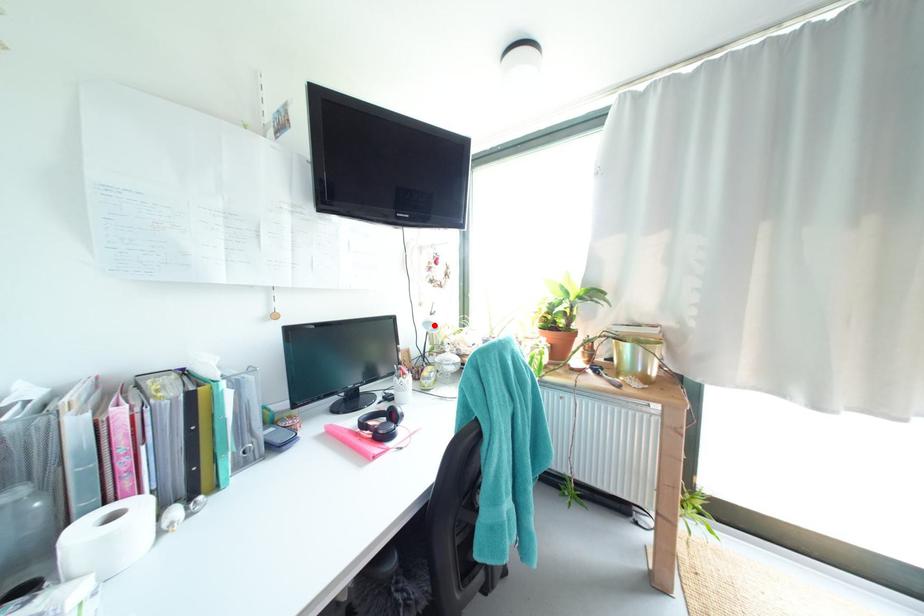
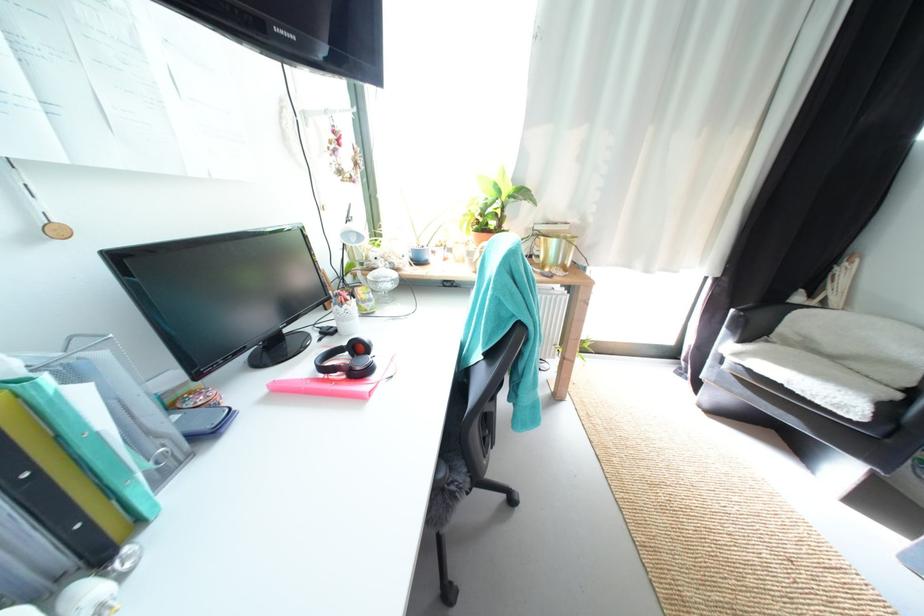
Question: I am providing you with two images of the same scene from different viewpoints. A red point is shown in image1. For the corresponding object point in image2, is it positioned nearer or farther from the camera?

Choices:
 (A) Nearer
 (B) Farther

Answer: (A)